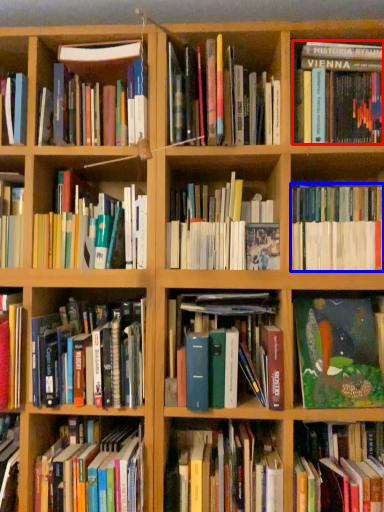
Question: Which object is closer to the camera taking this photo, book (highlighted by a red box) or book (highlighted by a blue box)?

Choices:
 (A) book
 (B) book

Answer: (B)